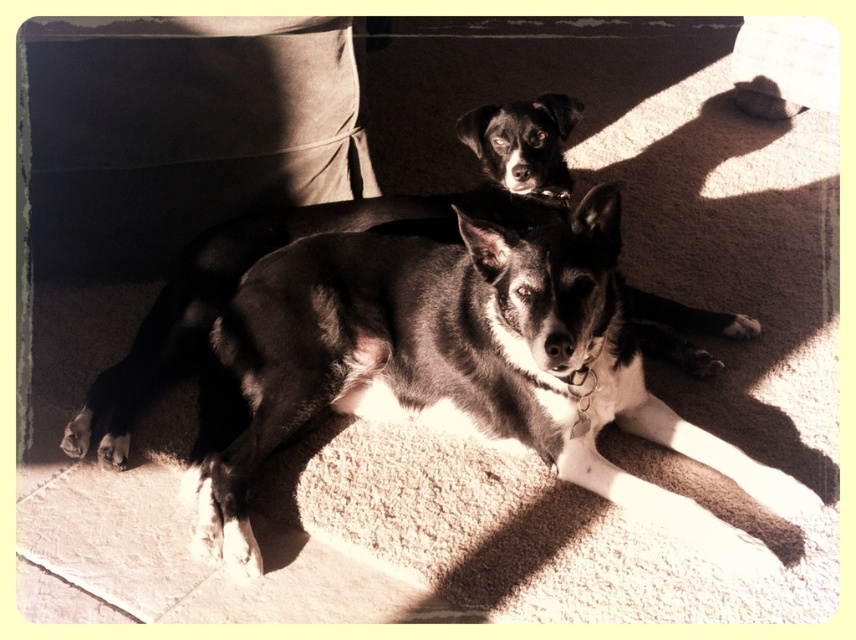
Question: Is shiny black fur at center to the left of shiny black dog at center from the viewer's perspective?

Choices:
 (A) no
 (B) yes

Answer: (A)

Question: Considering the relative positions of shiny black fur at center and shiny black dog at center in the image provided, where is shiny black fur at center located with respect to shiny black dog at center?

Choices:
 (A) above
 (B) below

Answer: (B)

Question: Which object is closer to the camera taking this photo?

Choices:
 (A) shiny black dog at center
 (B) shiny black fur at center

Answer: (B)

Question: Which point is farther to the camera?

Choices:
 (A) (390, 310)
 (B) (562, 163)

Answer: (B)

Question: Is shiny black fur at center smaller than shiny black dog at center?

Choices:
 (A) no
 (B) yes

Answer: (B)